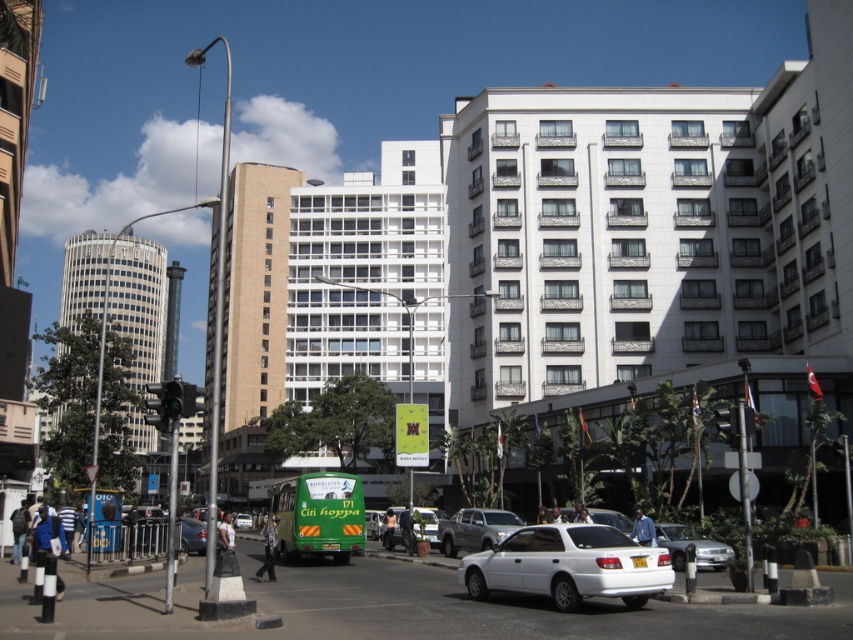
Question: Where is dark gray jacket at lower left located in relation to dark blue jeans at lower center in the image?

Choices:
 (A) above
 (B) below

Answer: (A)

Question: Which of the following is the closest to the observer?

Choices:
 (A) dark gray pants at center
 (B) dark skin human at center
 (C) skinny jeans at center
 (D) silver metallic sedan at lower right

Answer: (A)

Question: Is silver metallic sedan at lower right further to camera compared to dark blue jeans at lower center?

Choices:
 (A) yes
 (B) no

Answer: (B)

Question: Which is nearer to the white matte sedan at center?

Choices:
 (A) silver metallic sedan at lower right
 (B) blue fabric jacket at lower left
 (C) dark gray pants at center
 (D) silver metallic truck at center

Answer: (A)

Question: Which point is closer to the camera?

Choices:
 (A) green matte bus at center
 (B) blue shirt at center
 (C) dark gray jacket at lower left

Answer: (B)

Question: Is the position of dark gray pants at center more distant than that of dark skin human at center?

Choices:
 (A) yes
 (B) no

Answer: (B)